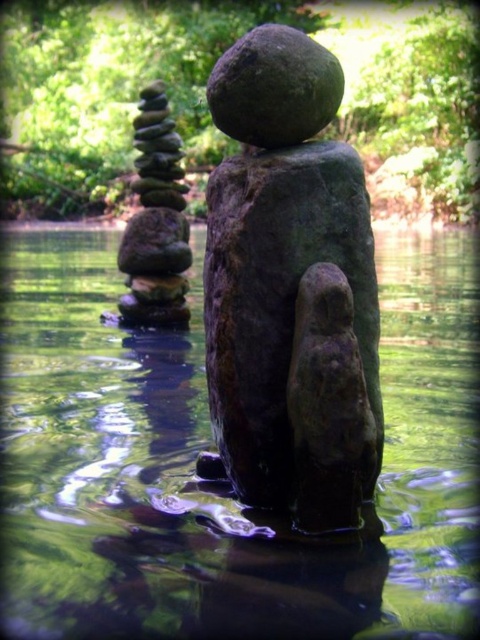
Question: Does rough stone statue at center appear on the right side of smooth gray stones at left?

Choices:
 (A) no
 (B) yes

Answer: (B)

Question: Which point is farther to the camera?

Choices:
 (A) green reflective water at center
 (B) rough stone statue at center
 (C) smooth gray stones at left

Answer: (C)

Question: Which point appears closest to the camera in this image?

Choices:
 (A) (269, 406)
 (B) (172, 176)
 (C) (304, 125)

Answer: (A)

Question: Does rough stone statue at center have a smaller size compared to smooth gray stones at left?

Choices:
 (A) yes
 (B) no

Answer: (A)

Question: Which object appears closest to the camera in this image?

Choices:
 (A) smooth gray stones at left
 (B) smooth dark brown rock at upper center
 (C) rough stone statue at center
 (D) green reflective water at center

Answer: (D)

Question: Is green reflective water at center positioned in front of smooth dark brown rock at upper center?

Choices:
 (A) no
 (B) yes

Answer: (B)